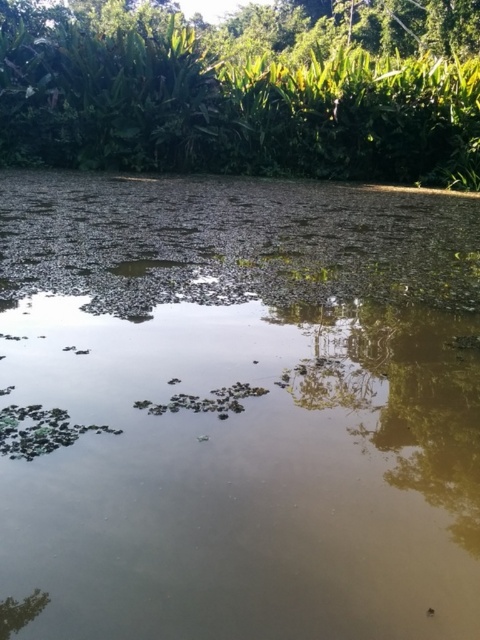
Who is shorter, brown murky water at center or green leafy trees at upper center?

brown murky water at center is shorter.

Is brown murky water at center above green leafy trees at upper center?

Incorrect, brown murky water at center is not positioned above green leafy trees at upper center.

Measure the distance between brown murky water at center and camera.

They are 1.26 meters apart.

In order to click on brown murky water at center in this screenshot , I will do `click(237, 410)`.